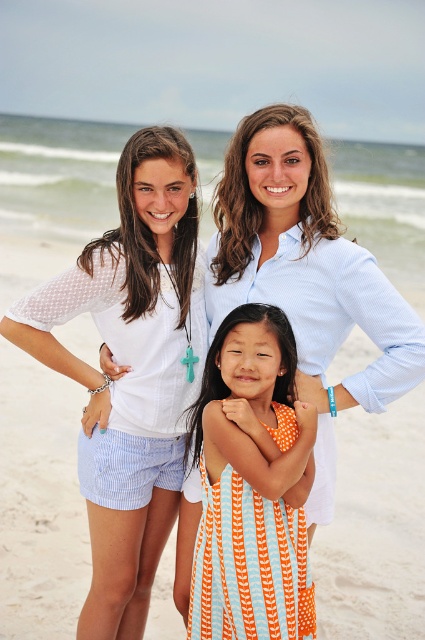
Is white seersucker shorts at left to the left of light blue striped shirt at center from the viewer's perspective?

Indeed, white seersucker shorts at left is positioned on the left side of light blue striped shirt at center.

This screenshot has width=425, height=640. Describe the element at coordinates (133, 371) in the screenshot. I see `white seersucker shorts at left` at that location.

Locate an element on the screen. white seersucker shorts at left is located at coordinates (133, 371).

Based on the photo, can you confirm if white seersucker shorts at left is positioned above orange striped dress at center?

Yes.

Between white seersucker shorts at left and orange striped dress at center, which one appears on the right side from the viewer's perspective?

Positioned to the right is orange striped dress at center.

Is point (132, 166) closer to viewer compared to point (280, 625)?

No, it is not.

Identify the location of white seersucker shorts at left. Image resolution: width=425 pixels, height=640 pixels. (133, 371).

Between light blue striped shirt at center and orange striped dress at center, which one is positioned lower?

Positioned lower is orange striped dress at center.

Can you confirm if light blue striped shirt at center is positioned below orange striped dress at center?

Actually, light blue striped shirt at center is above orange striped dress at center.

At what (x,y) coordinates should I click in order to perform the action: click on light blue striped shirt at center. Please return your answer as a coordinate pair (x, y). Looking at the image, I should click on (306, 273).

In order to click on light blue striped shirt at center in this screenshot , I will do `click(306, 273)`.